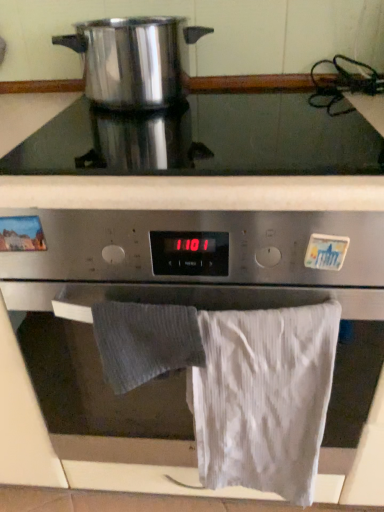
Measure the distance between point (370, 430) and camera.

Point (370, 430) and camera are 31.10 inches apart from each other.

Where is `white cotton towel at lower right, the 2th bath towel positioned from the left`? This screenshot has height=512, width=384. white cotton towel at lower right, the 2th bath towel positioned from the left is located at coordinates (263, 397).

The image size is (384, 512). What do you see at coordinates (205, 140) in the screenshot?
I see `satin silver cooktop at upper center` at bounding box center [205, 140].

The height and width of the screenshot is (512, 384). I want to click on stainless steel oven at center, so click(158, 302).

Is polished stainless steel pot at upper left positioned far away from white cotton towel at lower right, the 2th bath towel positioned from the left?

They are positioned close to each other.

Where is `kitchen appliance lying on the left of white cotton towel at lower right, arranged as the first bath towel when viewed from the right`? kitchen appliance lying on the left of white cotton towel at lower right, arranged as the first bath towel when viewed from the right is located at coordinates (133, 59).

Considering the points (187, 32) and (261, 352), which point is in front, point (187, 32) or point (261, 352)?

The point (261, 352) is in front.

Considering the relative positions of polished stainless steel pot at upper left and white cotton towel at lower right, arranged as the first bath towel when viewed from the right, in the image provided, is polished stainless steel pot at upper left to the right of white cotton towel at lower right, arranged as the first bath towel when viewed from the right, from the viewer's perspective?

Incorrect, polished stainless steel pot at upper left is not on the right side of white cotton towel at lower right, arranged as the first bath towel when viewed from the right.

Considering the sizes of objects satin silver cooktop at upper center and gray textured towel at lower center, acting as the second bath towel starting from the right, in the image provided, who is wider, satin silver cooktop at upper center or gray textured towel at lower center, acting as the second bath towel starting from the right,?

satin silver cooktop at upper center.

Does satin silver cooktop at upper center lie behind gray textured towel at lower center, the 1th bath towel in the left-to-right sequence?

Yes, satin silver cooktop at upper center is behind gray textured towel at lower center, the 1th bath towel in the left-to-right sequence.

Considering the sizes of objects satin silver cooktop at upper center and gray textured towel at lower center, acting as the second bath towel starting from the right, in the image provided, who is shorter, satin silver cooktop at upper center or gray textured towel at lower center, acting as the second bath towel starting from the right,?

With less height is satin silver cooktop at upper center.

Which of these two, gray textured towel at lower center, acting as the second bath towel starting from the right, or polished stainless steel pot at upper left, is thinner?

With smaller width is gray textured towel at lower center, acting as the second bath towel starting from the right.

Is point (109, 347) farther from camera compared to point (136, 18)?

That is False.

Between gray textured towel at lower center, acting as the second bath towel starting from the right, and polished stainless steel pot at upper left, which one is positioned behind?

polished stainless steel pot at upper left is more distant.

Is gray textured towel at lower center, the 1th bath towel in the left-to-right sequence, far from polished stainless steel pot at upper left?

No, gray textured towel at lower center, the 1th bath towel in the left-to-right sequence, is not far from polished stainless steel pot at upper left.

Is stainless steel oven at center taller than polished stainless steel pot at upper left?

Yes.

The width and height of the screenshot is (384, 512). I want to click on kitchen appliance that appears above the stainless steel oven at center (from a real-world perspective), so click(133, 59).

Considering the sizes of stainless steel oven at center and polished stainless steel pot at upper left in the image, is stainless steel oven at center bigger or smaller than polished stainless steel pot at upper left?

Clearly, stainless steel oven at center is larger in size than polished stainless steel pot at upper left.

Does stainless steel oven at center turn towards polished stainless steel pot at upper left?

No, stainless steel oven at center is not turned towards polished stainless steel pot at upper left.

Is stainless steel oven at center in front of or behind satin silver cooktop at upper center in the image?

In the image, stainless steel oven at center appears in front of satin silver cooktop at upper center.

From a real-world perspective, is stainless steel oven at center physically above satin silver cooktop at upper center?

No.

Is stainless steel oven at center to the right of satin silver cooktop at upper center from the viewer's perspective?

Correct, you'll find stainless steel oven at center to the right of satin silver cooktop at upper center.

Does stainless steel oven at center have a lesser height compared to satin silver cooktop at upper center?

Incorrect, the height of stainless steel oven at center does not fall short of that of satin silver cooktop at upper center.

Which object is further away from the camera, polished stainless steel pot at upper left or stainless steel oven at center?

polished stainless steel pot at upper left is more distant.

Is polished stainless steel pot at upper left positioned far away from stainless steel oven at center?

polished stainless steel pot at upper left is near stainless steel oven at center, not far away.

The width and height of the screenshot is (384, 512). Find the location of `oven in front of the polished stainless steel pot at upper left`. oven in front of the polished stainless steel pot at upper left is located at coordinates (158, 302).

Between polished stainless steel pot at upper left and stainless steel oven at center, which one appears on the right side from the viewer's perspective?

stainless steel oven at center.

Between polished stainless steel pot at upper left and gray textured towel at lower center, acting as the second bath towel starting from the right, which one has larger size?

polished stainless steel pot at upper left is bigger.

Based on their positions, is polished stainless steel pot at upper left located to the left or right of gray textured towel at lower center, the 1th bath towel in the left-to-right sequence?

Clearly, polished stainless steel pot at upper left is on the left of gray textured towel at lower center, the 1th bath towel in the left-to-right sequence, in the image.

From a real-world perspective, is polished stainless steel pot at upper left on top of gray textured towel at lower center, the 1th bath towel in the left-to-right sequence?

Indeed, from a real-world perspective, polished stainless steel pot at upper left stands above gray textured towel at lower center, the 1th bath towel in the left-to-right sequence.

Identify the location of kitchen appliance behind the white cotton towel at lower right, the 2th bath towel positioned from the left. The width and height of the screenshot is (384, 512). (133, 59).

Identify the location of bath towel that is the 1st one when counting downward from the satin silver cooktop at upper center (from the image's perspective). This screenshot has height=512, width=384. (145, 341).

From the image, which object appears to be farther from stainless steel oven at center, polished stainless steel pot at upper left or white cotton towel at lower right, arranged as the first bath towel when viewed from the right?

polished stainless steel pot at upper left.

When comparing their distances from polished stainless steel pot at upper left, does stainless steel oven at center or white cotton towel at lower right, the 2th bath towel positioned from the left, seem further?

white cotton towel at lower right, the 2th bath towel positioned from the left, is positioned further to the anchor polished stainless steel pot at upper left.

When comparing their distances from gray textured towel at lower center, the 1th bath towel in the left-to-right sequence, does stainless steel oven at center or satin silver cooktop at upper center seem further?

Based on the image, satin silver cooktop at upper center appears to be further to gray textured towel at lower center, the 1th bath towel in the left-to-right sequence.

From the image, which object appears to be farther from polished stainless steel pot at upper left, white cotton towel at lower right, arranged as the first bath towel when viewed from the right, or stainless steel oven at center?

white cotton towel at lower right, arranged as the first bath towel when viewed from the right, is further to polished stainless steel pot at upper left.

Consider the image. From the image, which object appears to be nearer to gray textured towel at lower center, the 1th bath towel in the left-to-right sequence, white cotton towel at lower right, arranged as the first bath towel when viewed from the right, or stainless steel oven at center?

white cotton towel at lower right, arranged as the first bath towel when viewed from the right.

From the image, which object appears to be farther from polished stainless steel pot at upper left, gray textured towel at lower center, acting as the second bath towel starting from the right, or white cotton towel at lower right, arranged as the first bath towel when viewed from the right?

white cotton towel at lower right, arranged as the first bath towel when viewed from the right, lies further to polished stainless steel pot at upper left than the other object.

Which object lies further to the anchor point polished stainless steel pot at upper left, satin silver cooktop at upper center or stainless steel oven at center?

stainless steel oven at center is further to polished stainless steel pot at upper left.

Looking at the image, which one is located closer to white cotton towel at lower right, arranged as the first bath towel when viewed from the right, gray textured towel at lower center, acting as the second bath towel starting from the right, or stainless steel oven at center?

The object closer to white cotton towel at lower right, arranged as the first bath towel when viewed from the right, is stainless steel oven at center.

This screenshot has height=512, width=384. In order to click on oven that lies between polished stainless steel pot at upper left and gray textured towel at lower center, acting as the second bath towel starting from the right, from top to bottom in this screenshot , I will do `click(158, 302)`.

Where is `oven between polished stainless steel pot at upper left and white cotton towel at lower right, arranged as the first bath towel when viewed from the right, vertically`? The image size is (384, 512). oven between polished stainless steel pot at upper left and white cotton towel at lower right, arranged as the first bath towel when viewed from the right, vertically is located at coordinates (158, 302).

Locate an element on the screen. The image size is (384, 512). gas stove between polished stainless steel pot at upper left and gray textured towel at lower center, acting as the second bath towel starting from the right, from top to bottom is located at coordinates (205, 140).

Locate an element on the screen. This screenshot has height=512, width=384. oven that lies between satin silver cooktop at upper center and gray textured towel at lower center, the 1th bath towel in the left-to-right sequence, from top to bottom is located at coordinates (158, 302).